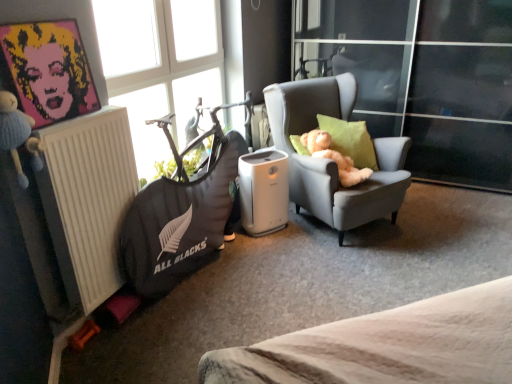
Locate an element on the screen. This screenshot has width=512, height=384. vacant space in front of gray fabric armchair at center is located at coordinates (336, 274).